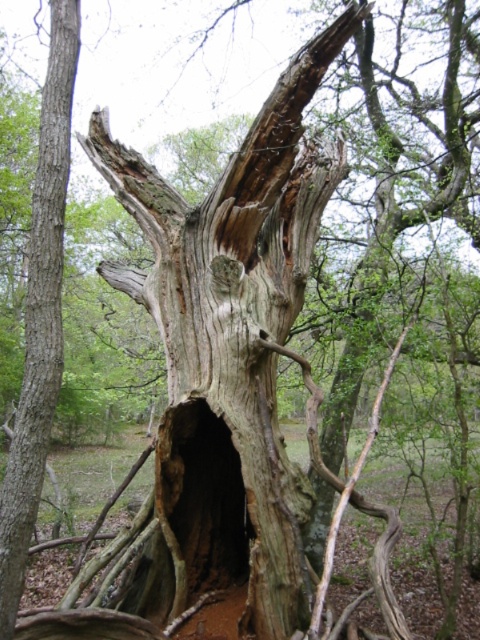
Which is in front, point (21, 465) or point (191, 465)?

Positioned in front is point (21, 465).

In the scene shown: Is grayish-brown bark tree trunk at center smaller than dark wood hole at center?

No.

Who is more forward, [35,404] or [168,417]?

Point [35,404] is more forward.

You are a GUI agent. You are given a task and a screenshot of the screen. Output one action in this format:
    pyautogui.click(x=<x>, y=<y>)
    Task: Click on the grayish-brown bark tree trunk at center
    This screenshot has width=480, height=640.
    Given the screenshot: What is the action you would take?
    point(39,312)